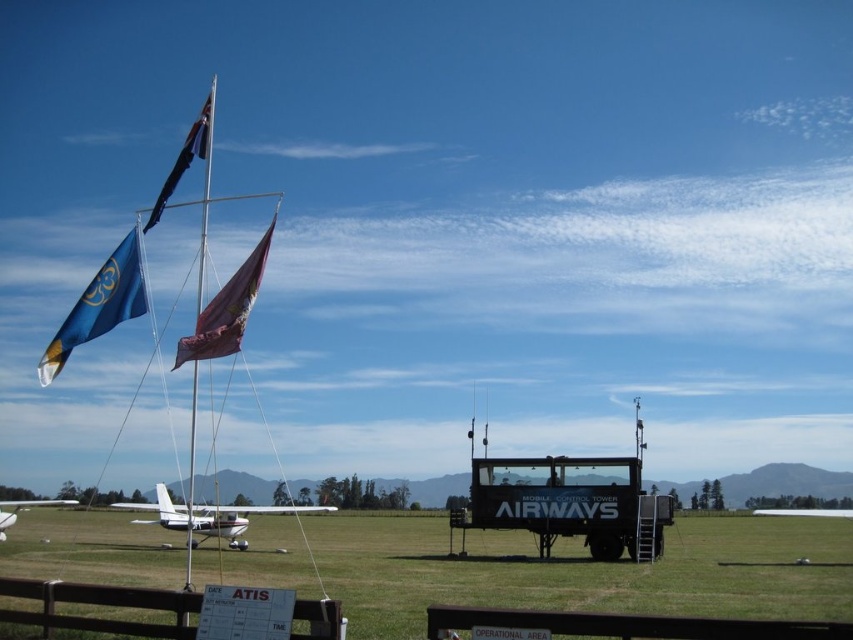
Who is higher up, green grassy field at center or metallic flag pole at center?

metallic flag pole at center is above.

Consider the image. Is green grassy field at center to the right of metallic flag pole at center from the viewer's perspective?

Indeed, green grassy field at center is positioned on the right side of metallic flag pole at center.

Who is more distant from viewer, (15, 528) or (202, 214)?

The point (202, 214) is behind.

Locate an element on the screen. green grassy field at center is located at coordinates (582, 570).

Is blue fabric flag at upper left bigger than blue fabric flag at upper center?

Actually, blue fabric flag at upper left might be smaller than blue fabric flag at upper center.

Is blue fabric flag at upper left above blue fabric flag at upper center?

Incorrect, blue fabric flag at upper left is not positioned above blue fabric flag at upper center.

This screenshot has width=853, height=640. What do you see at coordinates (100, 305) in the screenshot?
I see `blue fabric flag at upper left` at bounding box center [100, 305].

The image size is (853, 640). In order to click on blue fabric flag at upper left in this screenshot , I will do `click(100, 305)`.

Between green grassy field at center and blue fabric flag at upper left, which one is positioned higher?

Positioned higher is blue fabric flag at upper left.

Does green grassy field at center come in front of blue fabric flag at upper left?

Yes, green grassy field at center is in front of blue fabric flag at upper left.

Who is more forward, (x=247, y=580) or (x=105, y=314)?

Positioned in front is point (x=105, y=314).

At what (x,y) coordinates should I click in order to perform the action: click on green grassy field at center. Please return your answer as a coordinate pair (x, y). Looking at the image, I should click on (582, 570).